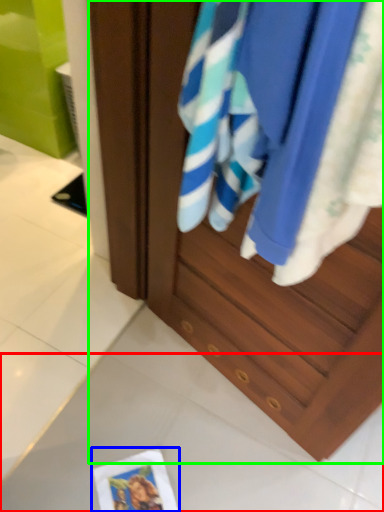
Question: Which object is positioned farthest from tile (highlighted by a red box)? Select from postcard (highlighted by a blue box) and cabinetry (highlighted by a green box).

Choices:
 (A) postcard
 (B) cabinetry

Answer: (B)